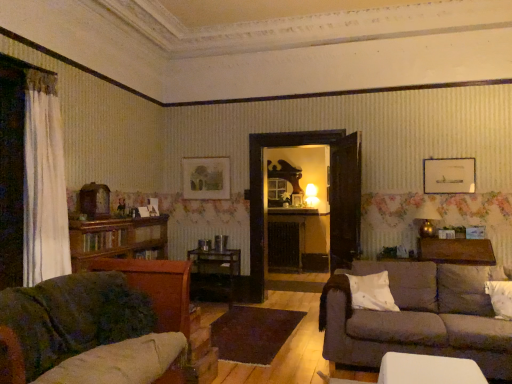
The image size is (512, 384). I want to click on white fabric pillow at lower right, which is counted as the second pillow, starting from the left, so click(x=500, y=298).

The image size is (512, 384). I want to click on velvet green couch at lower left, arranged as the 2th studio couch when viewed from the back, so click(74, 316).

What is the approximate width of velvet green couch at lower left, the 2th studio couch in the right-to-left sequence?

The width of velvet green couch at lower left, the 2th studio couch in the right-to-left sequence, is 96.31 centimeters.

This screenshot has width=512, height=384. What do you see at coordinates (206, 178) in the screenshot?
I see `matte wooden picture frame at upper center, positioned as the 2th picture frame in front-to-back order` at bounding box center [206, 178].

At what (x,y) coordinates should I click in order to perform the action: click on wooden glossy table at center, which is the 2th table in right-to-left order. Please return your answer as a coordinate pair (x, y). Looking at the image, I should click on (215, 273).

Can you confirm if white matte pillow at center, the second pillow positioned from the right, is wider than matte white picture frame at upper right, the first picture frame positioned from the front?

Yes, white matte pillow at center, the second pillow positioned from the right, is wider than matte white picture frame at upper right, the first picture frame positioned from the front.

From the image's perspective, which one is positioned lower, white matte pillow at center, the second pillow positioned from the right, or matte white picture frame at upper right, which ranks as the second picture frame in back-to-front order?

white matte pillow at center, the second pillow positioned from the right, appears lower in the image.

Is white matte pillow at center, the second pillow positioned from the right, spatially inside matte white picture frame at upper right, which ranks as the second picture frame in back-to-front order, or outside of it?

white matte pillow at center, the second pillow positioned from the right, is outside matte white picture frame at upper right, which ranks as the second picture frame in back-to-front order.

Identify the location of the 1st pillow in front of the matte white picture frame at upper right, the first picture frame positioned from the front. (372, 292).

From a real-world perspective, does matte white picture frame at upper right, the first picture frame positioned from the front, sit lower than velvet green couch at lower left, the 2th studio couch in the right-to-left sequence?

No, from a real-world perspective, matte white picture frame at upper right, the first picture frame positioned from the front, is not beneath velvet green couch at lower left, the 2th studio couch in the right-to-left sequence.

Identify the location of the 2nd picture frame to the right when counting from the velvet green couch at lower left, arranged as the first studio couch when viewed from the left. The height and width of the screenshot is (384, 512). [x=449, y=176].

Considering the positions of point (452, 172) and point (132, 289), is point (452, 172) closer or farther from the camera than point (132, 289)?

Point (452, 172) is farther from the camera than point (132, 289).

Locate an element on the screen. studio couch that is the 1st one when counting forward from the white matte pillow at center, which is counted as the first pillow, starting from the left is located at coordinates (417, 318).

In the scene shown: Is white matte pillow at center, which is counted as the first pillow, starting from the left, closer to camera compared to dark brown fabric couch at lower right, arranged as the 1th studio couch when viewed from the back?

No, white matte pillow at center, which is counted as the first pillow, starting from the left, is further to the viewer.

Considering the relative sizes of white matte pillow at center, which is counted as the first pillow, starting from the left, and dark brown fabric couch at lower right, which ranks as the second studio couch in front-to-back order, in the image provided, is white matte pillow at center, which is counted as the first pillow, starting from the left, shorter than dark brown fabric couch at lower right, which ranks as the second studio couch in front-to-back order,?

Yes.

Is white matte pillow at center, which is counted as the first pillow, starting from the left, aimed at dark brown fabric couch at lower right, arranged as the 1th studio couch when viewed from the back?

Yes, white matte pillow at center, which is counted as the first pillow, starting from the left, is turned towards dark brown fabric couch at lower right, arranged as the 1th studio couch when viewed from the back.

From the image's perspective, does matte white picture frame at upper right, which ranks as the second picture frame in back-to-front order, appear higher than brown wood table at right, which appears as the second table when viewed from the left?

Indeed, from the image's perspective, matte white picture frame at upper right, which ranks as the second picture frame in back-to-front order, is shown above brown wood table at right, which appears as the second table when viewed from the left.

From a real-world perspective, is matte white picture frame at upper right, the second picture frame from the left, on brown wood table at right, the first table positioned from the front?

Yes.

Between matte white picture frame at upper right, which is the 1th picture frame in right-to-left order, and brown wood table at right, which appears as the second table when viewed from the left, which one appears on the right side from the viewer's perspective?

From the viewer's perspective, matte white picture frame at upper right, which is the 1th picture frame in right-to-left order, appears more on the right side.

Does matte white picture frame at upper right, the first picture frame positioned from the front, lie in front of brown wood table at right, arranged as the second table when ordered from the bottom?

No, matte white picture frame at upper right, the first picture frame positioned from the front, is further to the viewer.

From their relative heights in the image, would you say white fabric pillow at lower right, the 1th pillow viewed from the right, is taller or shorter than white matte pillow at center, the second pillow positioned from the right?

Considering their sizes, white fabric pillow at lower right, the 1th pillow viewed from the right, has more height than white matte pillow at center, the second pillow positioned from the right.

Which object is closer to the camera taking this photo, white fabric pillow at lower right, which is counted as the second pillow, starting from the left, or white matte pillow at center, which is counted as the first pillow, starting from the left?

white fabric pillow at lower right, which is counted as the second pillow, starting from the left, is closer to the camera.

Considering the sizes of objects white fabric pillow at lower right, the 1th pillow viewed from the right, and white matte pillow at center, which is counted as the first pillow, starting from the left, in the image provided, who is thinner, white fabric pillow at lower right, the 1th pillow viewed from the right, or white matte pillow at center, which is counted as the first pillow, starting from the left,?

white matte pillow at center, which is counted as the first pillow, starting from the left, is thinner.

Considering the sizes of objects dark brown fabric couch at lower right, arranged as the 1th studio couch when viewed from the back, and white matte pillow at center, the second pillow positioned from the right, in the image provided, who is taller, dark brown fabric couch at lower right, arranged as the 1th studio couch when viewed from the back, or white matte pillow at center, the second pillow positioned from the right,?

dark brown fabric couch at lower right, arranged as the 1th studio couch when viewed from the back.

From the image's perspective, is dark brown fabric couch at lower right, the 2th studio couch when ordered from left to right, above or below white matte pillow at center, which is counted as the first pillow, starting from the left?

Based on their image positions, dark brown fabric couch at lower right, the 2th studio couch when ordered from left to right, is located beneath white matte pillow at center, which is counted as the first pillow, starting from the left.

Could you tell me if dark brown fabric couch at lower right, the 2th studio couch when ordered from left to right, is facing white matte pillow at center, which is counted as the first pillow, starting from the left?

Yes, dark brown fabric couch at lower right, the 2th studio couch when ordered from left to right, is facing white matte pillow at center, which is counted as the first pillow, starting from the left.

Based on the photo, is dark brown fabric couch at lower right, the 1th studio couch positioned from the right, not close to white matte pillow at center, the second pillow positioned from the right?

No, dark brown fabric couch at lower right, the 1th studio couch positioned from the right, is in close proximity to white matte pillow at center, the second pillow positioned from the right.

Based on the photo, would you say wooden glossy table at center, which is the 2th table in right-to-left order, is to the left or to the right of white matte pillow at center, the second pillow positioned from the right, in the picture?

Clearly, wooden glossy table at center, which is the 2th table in right-to-left order, is on the left of white matte pillow at center, the second pillow positioned from the right, in the image.

Is wooden glossy table at center, which is the 2th table in right-to-left order, positioned beyond the bounds of white matte pillow at center, which is counted as the first pillow, starting from the left?

Indeed, wooden glossy table at center, which is the 2th table in right-to-left order, is completely outside white matte pillow at center, which is counted as the first pillow, starting from the left.

Locate an element on the screen. table lying below the white matte pillow at center, which is counted as the first pillow, starting from the left (from the image's perspective) is located at coordinates (215, 273).

Considering the sizes of wooden glossy table at center, which is the 2th table in front-to-back order, and white matte pillow at center, which is counted as the first pillow, starting from the left, in the image, is wooden glossy table at center, which is the 2th table in front-to-back order, taller or shorter than white matte pillow at center, which is counted as the first pillow, starting from the left,?

Considering their sizes, wooden glossy table at center, which is the 2th table in front-to-back order, has more height than white matte pillow at center, which is counted as the first pillow, starting from the left.

From a real-world perspective, which picture frame is the 1st one above the white matte pillow at center, the second pillow positioned from the right? Please provide its 2D coordinates.

[(449, 176)]

Find the location of a particular element. The width and height of the screenshot is (512, 384). the 2nd studio couch in front of the matte white picture frame at upper right, which is the 1th picture frame in right-to-left order, counting from the anchor's position is located at coordinates (74, 316).

Based on their spatial positions, is brown wooden bookcase at left or dark brown fabric couch at lower right, which ranks as the second studio couch in front-to-back order, closer to white fabric pillow at lower right, which is counted as the second pillow, starting from the left?

dark brown fabric couch at lower right, which ranks as the second studio couch in front-to-back order, is closer to white fabric pillow at lower right, which is counted as the second pillow, starting from the left.

Looking at the image, which one is located closer to brown wooden bookcase at left, white fabric pillow at lower right, the 1th pillow viewed from the right, or wooden glossy table at center, which is the 2th table in front-to-back order?

Among the two, wooden glossy table at center, which is the 2th table in front-to-back order, is located nearer to brown wooden bookcase at left.

Estimate the real-world distances between objects in this image. Which object is further from matte white picture frame at upper right, which is the 1th picture frame in right-to-left order, white matte pillow at center, which is counted as the first pillow, starting from the left, or wooden glossy table at center, which appears as the first table when viewed from the back?

Among the two, wooden glossy table at center, which appears as the first table when viewed from the back, is located further to matte white picture frame at upper right, which is the 1th picture frame in right-to-left order.

Based on their spatial positions, is brown wooden bookcase at left or matte white picture frame at upper right, the second picture frame from the left, closer to white fabric pillow at lower right, which is counted as the second pillow, starting from the left?

matte white picture frame at upper right, the second picture frame from the left, lies closer to white fabric pillow at lower right, which is counted as the second pillow, starting from the left, than the other object.

From the image, which object appears to be farther from matte wooden picture frame at upper center, arranged as the 1th picture frame when viewed from the back, wooden glossy table at center, which is the first table in left-to-right order, or white matte pillow at center, which is counted as the first pillow, starting from the left?

Based on the image, white matte pillow at center, which is counted as the first pillow, starting from the left, appears to be further to matte wooden picture frame at upper center, arranged as the 1th picture frame when viewed from the back.

Considering their positions, is matte wooden picture frame at upper center, the 2th picture frame positioned from the right, positioned further to matte white picture frame at upper right, the first picture frame positioned from the front, than dark brown fabric couch at lower right, the 1th studio couch positioned from the right?

Among the two, matte wooden picture frame at upper center, the 2th picture frame positioned from the right, is located further to matte white picture frame at upper right, the first picture frame positioned from the front.

Considering their positions, is velvet green couch at lower left, which is the first studio couch from front to back, positioned further to brown wooden bookcase at left than wooden glossy table at center, the second table in the top-to-bottom sequence?

wooden glossy table at center, the second table in the top-to-bottom sequence, is positioned further to the anchor brown wooden bookcase at left.

Estimate the real-world distances between objects in this image. Which object is closer to white matte pillow at center, which is counted as the first pillow, starting from the left, velvet green couch at lower left, arranged as the first studio couch when viewed from the left, or brown wooden bookcase at left?

velvet green couch at lower left, arranged as the first studio couch when viewed from the left, is positioned closer to the anchor white matte pillow at center, which is counted as the first pillow, starting from the left.

This screenshot has height=384, width=512. What are the coordinates of `studio couch located between wooden glossy table at center, which appears as the first table when viewed from the back, and white fabric pillow at lower right, the 1th pillow viewed from the right, in the left-right direction` in the screenshot? It's located at (417, 318).

Where is `table between brown wooden bookcase at left and white fabric pillow at lower right, which is counted as the second pillow, starting from the left, from left to right`? The height and width of the screenshot is (384, 512). table between brown wooden bookcase at left and white fabric pillow at lower right, which is counted as the second pillow, starting from the left, from left to right is located at coordinates (215, 273).

Find the location of a particular element. The width and height of the screenshot is (512, 384). pillow located between white fabric pillow at lower right, which is counted as the second pillow, starting from the left, and matte wooden picture frame at upper center, which ranks as the first picture frame in left-to-right order, in the depth direction is located at coordinates (372, 292).

Where is `table between brown wooden bookcase at left and dark brown fabric couch at lower right, the 1th studio couch positioned from the right, in the horizontal direction`? table between brown wooden bookcase at left and dark brown fabric couch at lower right, the 1th studio couch positioned from the right, in the horizontal direction is located at coordinates (215, 273).